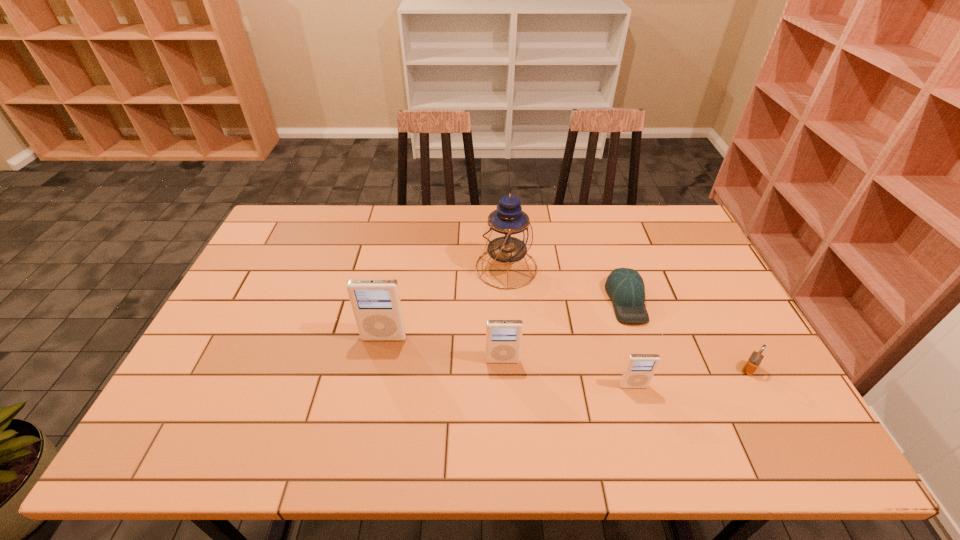
This screenshot has width=960, height=540. Identify the location of the leftmost iPod. (376, 303).

This screenshot has height=540, width=960. I want to click on the farthest iPod, so click(376, 303).

I want to click on the second nearest iPod, so pyautogui.click(x=503, y=337).

The width and height of the screenshot is (960, 540). What are the coordinates of `the second iPod from left to right` in the screenshot? It's located at (503, 337).

I want to click on the nearest object, so tap(639, 369).

Find the location of a particular element. This screenshot has width=960, height=540. the rightmost iPod is located at coordinates (639, 369).

The width and height of the screenshot is (960, 540). What are the coordinates of `the rightmost object` in the screenshot? It's located at (753, 362).

Find the location of a particular element. padlock is located at coordinates [x=753, y=362].

The height and width of the screenshot is (540, 960). I want to click on lantern, so click(x=508, y=234).

Locate an element on the screen. The width and height of the screenshot is (960, 540). baseball cap is located at coordinates (625, 287).